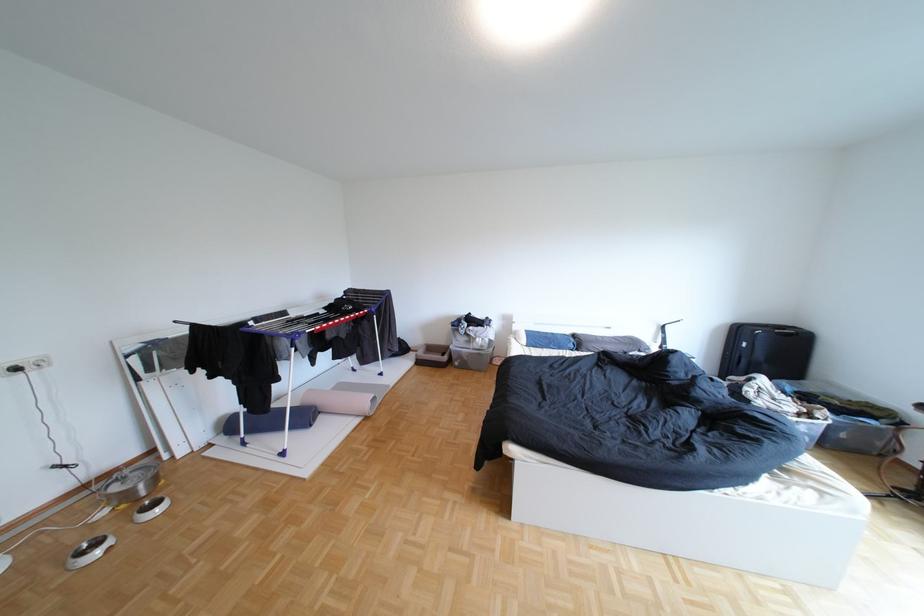
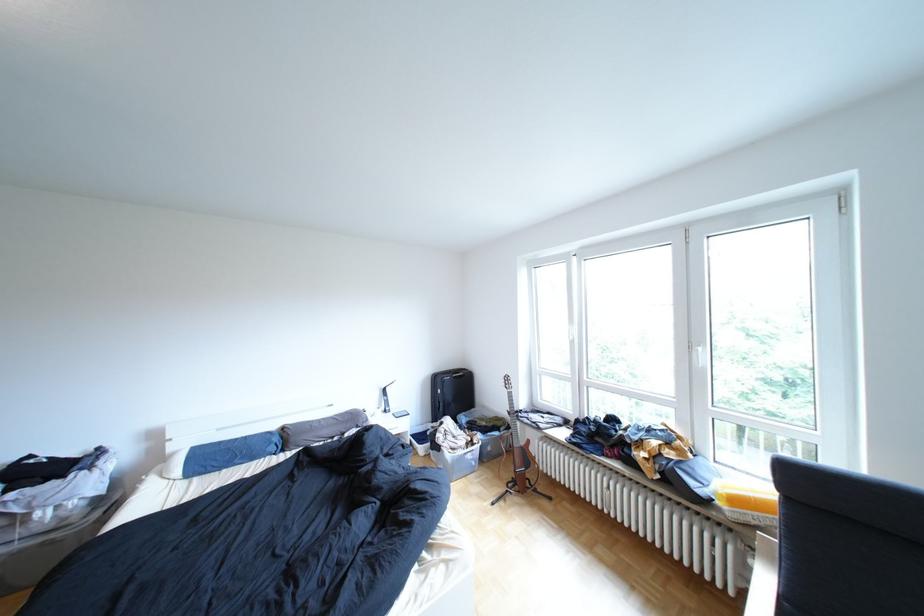
In the second image, find the point that corresponds to point (540, 341) in the first image.

(193, 472)